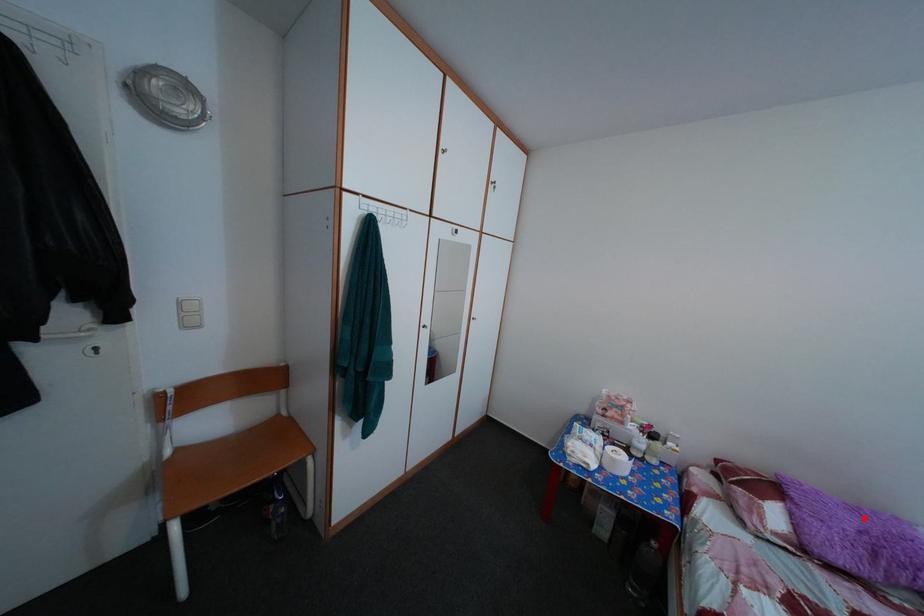
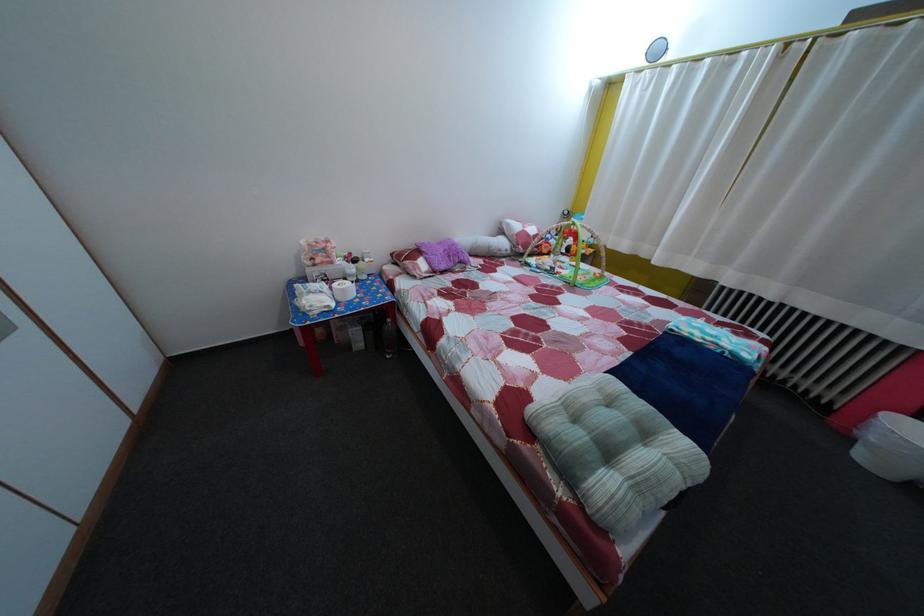
In the second image, find the point that corresponds to the highlighted location in the first image.

(450, 252)